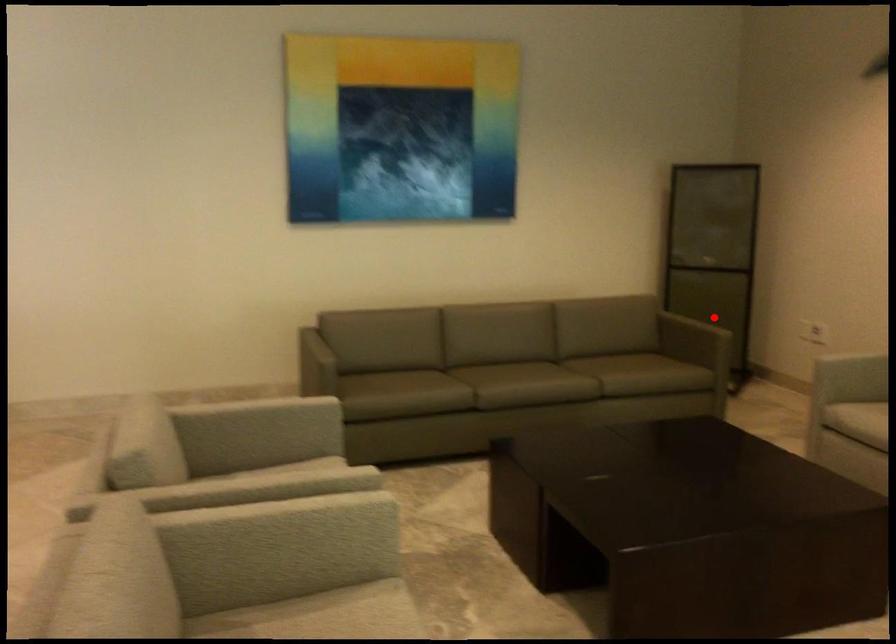
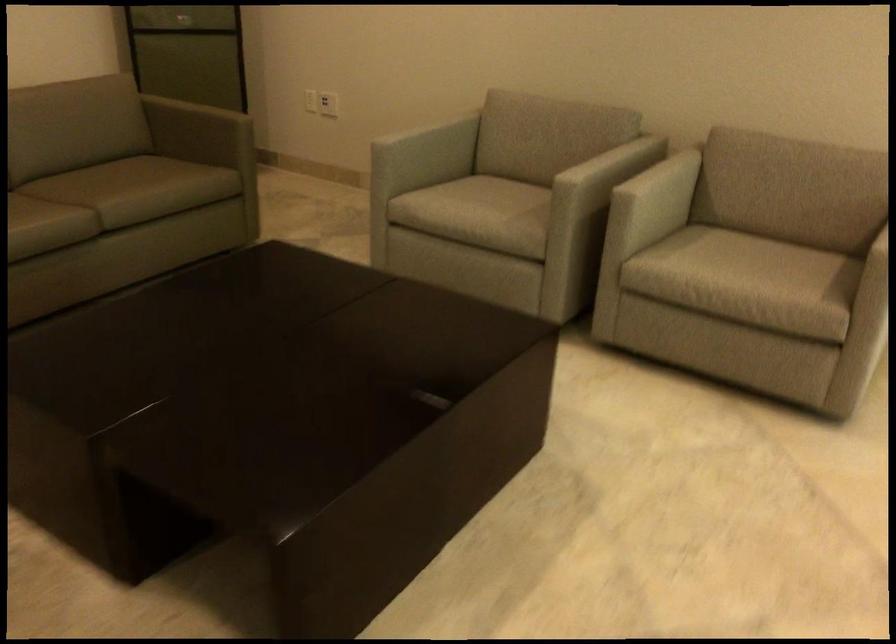
In the second image, find the point that corresponds to the highlighted location in the first image.

(225, 93)